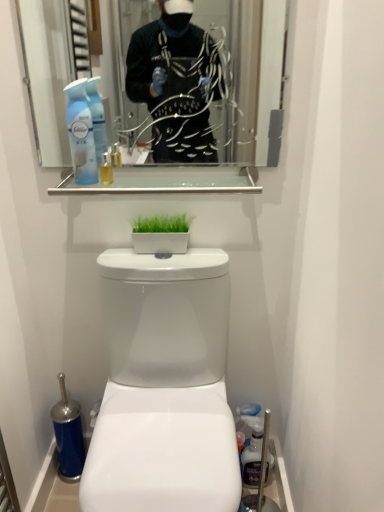
Locate an element on the screen. The image size is (384, 512). vacant region below clear glass shelf at upper center (from a real-world perspective) is located at coordinates (165, 256).